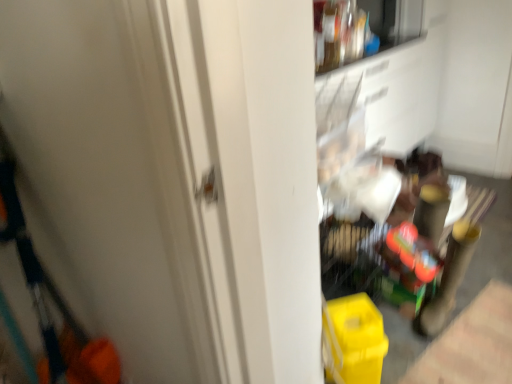
Identify the location of white matte screen door at left. (116, 173).

Measure the distance between white matte screen door at left and camera.

They are 19.12 inches apart.

What do you see at coordinates (116, 173) in the screenshot? This screenshot has height=384, width=512. I see `white matte screen door at left` at bounding box center [116, 173].

You are a GUI agent. You are given a task and a screenshot of the screen. Output one action in this format:
    pyautogui.click(x=<x>, y=<y>)
    Task: Click on the white matte screen door at left
    
    Given the screenshot: What is the action you would take?
    pyautogui.click(x=116, y=173)